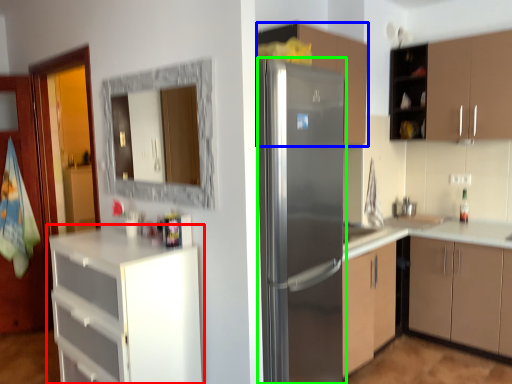
Question: Based on their relative distances, which object is nearer to cabinetry (highlighted by a red box)? Choose from cabinetry (highlighted by a blue box) and refrigerator (highlighted by a green box).

Choices:
 (A) cabinetry
 (B) refrigerator

Answer: (B)